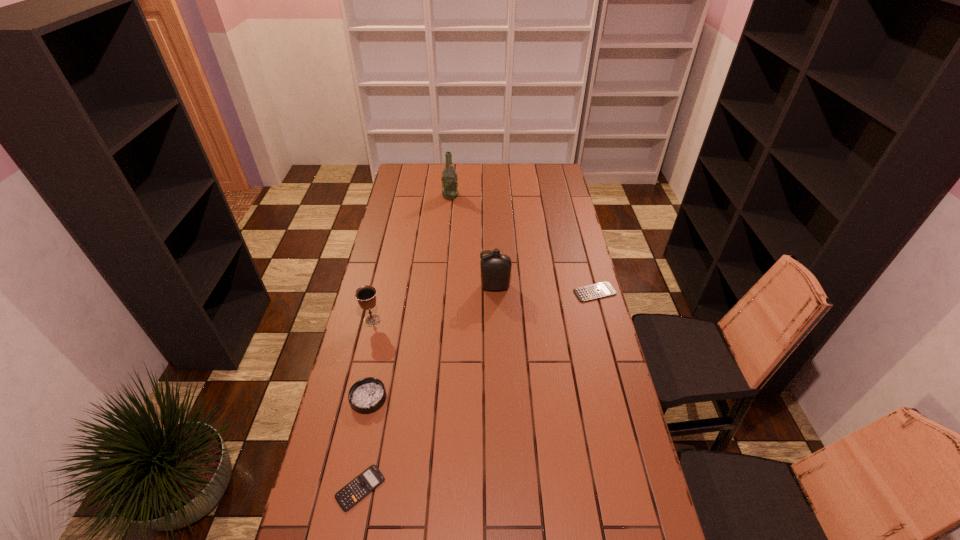
At what (x,y) coordinates should I click in order to perform the action: click on the fourth tallest object. Please return your answer as a coordinate pair (x, y). This screenshot has width=960, height=540. Looking at the image, I should click on (367, 395).

Locate an element on the screen. This screenshot has width=960, height=540. the fifth farthest object is located at coordinates (367, 395).

Find the location of a particular element. The width and height of the screenshot is (960, 540). vacant space situated 0.060m on the left of the shorter calculator is located at coordinates (315, 488).

The height and width of the screenshot is (540, 960). I want to click on free space located on the left of the second shortest object, so click(x=556, y=292).

At what (x,y) coordinates should I click in order to perform the action: click on free space located on the surface of the tallest object. Please return your answer as a coordinate pair (x, y). The image size is (960, 540). Looking at the image, I should click on (516, 195).

Locate an element on the screen. Image resolution: width=960 pixels, height=540 pixels. vacant space located on the right of the chalice is located at coordinates (452, 320).

The width and height of the screenshot is (960, 540). I want to click on vacant space situated 0.310m on the back of the second tallest object, so click(493, 234).

I want to click on blank space located on the right of the fourth tallest object, so click(437, 398).

Locate an element on the screen. The height and width of the screenshot is (540, 960). object that is at the near edge is located at coordinates (347, 497).

Where is `calculator present at the left edge`? calculator present at the left edge is located at coordinates (347, 497).